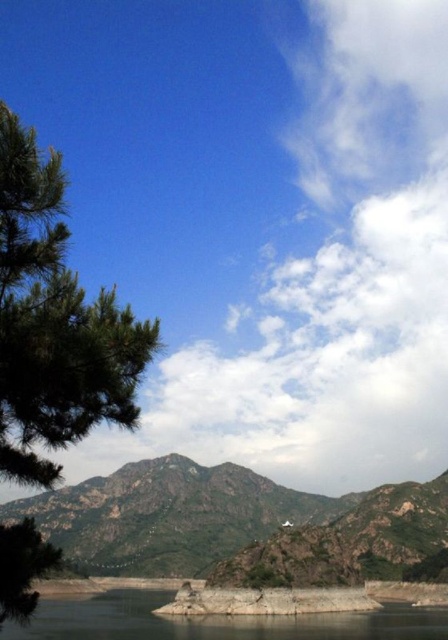
You are standing at the edge of the clear water at lower left and want to reach the rugged stone mountain at center. Which direction should you head towards?

You should head to the right to reach the rugged stone mountain at center since it is located to the right of the clear water at lower left.

You are standing at the point with coordinates point [68,392] and want to walk towards the point with coordinates point [245,492]. According to the scene description, will you have to go through the water?

Yes, you will have to go through the water because the point [68,392] is in front of point [245,492], meaning the path between them crosses the body of water in the foreground.